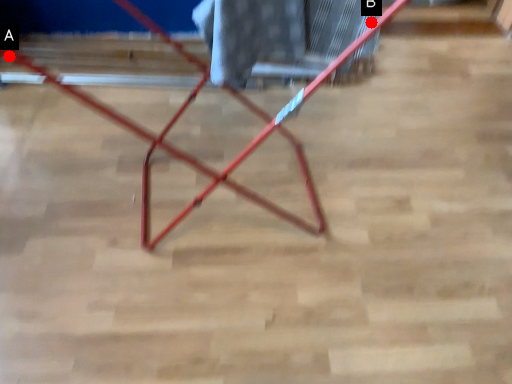
Question: Two points are circled on the image, labeled by A and B beside each circle. Which of the following is the closest to the observer?

Choices:
 (A) A is closer
 (B) B is closer

Answer: (B)